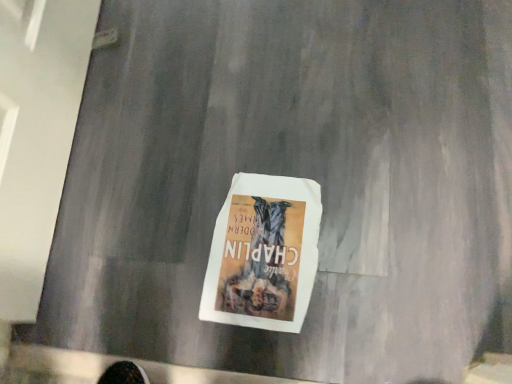
This screenshot has height=384, width=512. Identify the location of free space to the left of white paper at center. (152, 275).